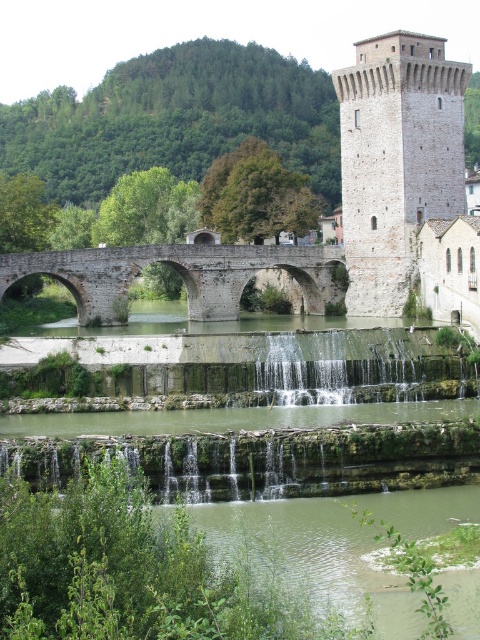
Is white stone tower at upper right taller than stone arch bridge at center?

Yes.

From the picture: Can you confirm if white stone tower at upper right is bigger than stone arch bridge at center?

Actually, white stone tower at upper right might be smaller than stone arch bridge at center.

Where is `white stone tower at upper right`? Image resolution: width=480 pixels, height=640 pixels. white stone tower at upper right is located at coordinates (396, 160).

Which is more to the right, stone tower at center or white stone tower at upper right?

white stone tower at upper right

Does stone tower at center have a larger size compared to white stone tower at upper right?

Correct, stone tower at center is larger in size than white stone tower at upper right.

The image size is (480, 640). Describe the element at coordinates (396, 160) in the screenshot. I see `stone tower at center` at that location.

At what (x,y) coordinates should I click in order to perform the action: click on stone tower at center. Please return your answer as a coordinate pair (x, y). Looking at the image, I should click on (396, 160).

The width and height of the screenshot is (480, 640). In order to click on stone tower at center in this screenshot , I will do `click(396, 160)`.

Who is higher up, stone tower at center or stone arch bridge at center?

Positioned higher is stone tower at center.

Is point (348, 68) positioned after point (79, 256)?

Yes.

The width and height of the screenshot is (480, 640). Find the location of `stone tower at center`. stone tower at center is located at coordinates (396, 160).